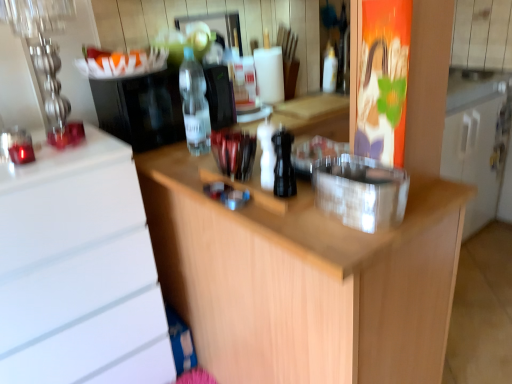
The image size is (512, 384). I want to click on free space between transparent plastic container at center, which appears as the first appliance when viewed from the right, and black matte pepper grinder at center, the second bottle viewed from the right, so click(308, 197).